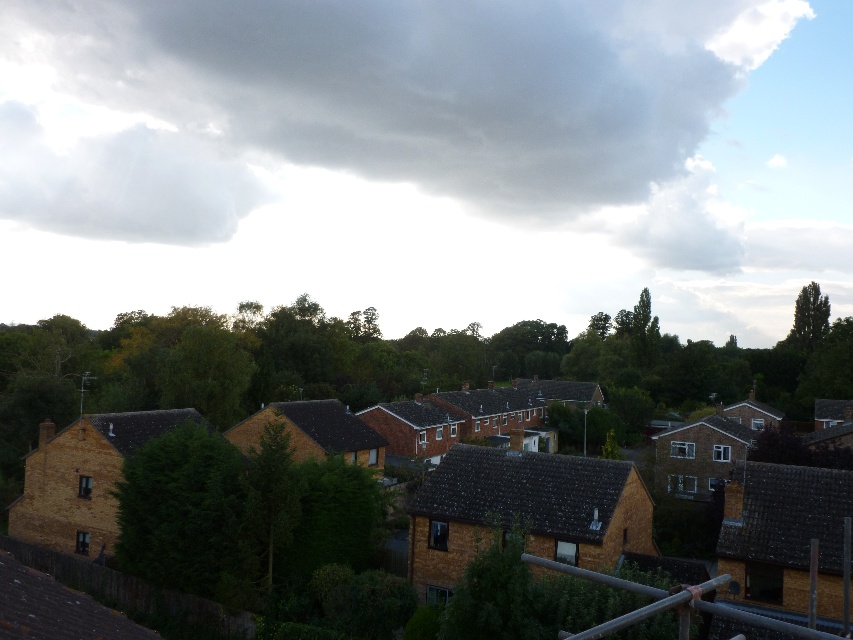
Question: Does green leafy tree at left lie behind metallic gray rail at lower right?

Choices:
 (A) no
 (B) yes

Answer: (B)

Question: Can you confirm if gray fluffy cloud at upper center is positioned below white fluffy cloud at upper left?

Choices:
 (A) yes
 (B) no

Answer: (B)

Question: Estimate the real-world distances between objects in this image. Which object is farther from the gray fluffy cloud at upper center?

Choices:
 (A) white fluffy cloud at upper left
 (B) green leafy tree at upper right

Answer: (B)

Question: Which point is closer to the camera?

Choices:
 (A) (78, 188)
 (B) (793, 625)
 (C) (431, 72)

Answer: (B)

Question: Is gray fluffy cloud at upper center to the right of green leafy tree at upper right from the viewer's perspective?

Choices:
 (A) yes
 (B) no

Answer: (B)

Question: Which of the following is the closest to the observer?

Choices:
 (A) (247, 202)
 (B) (142, 522)
 (C) (544, 96)
 (D) (746, 621)

Answer: (D)